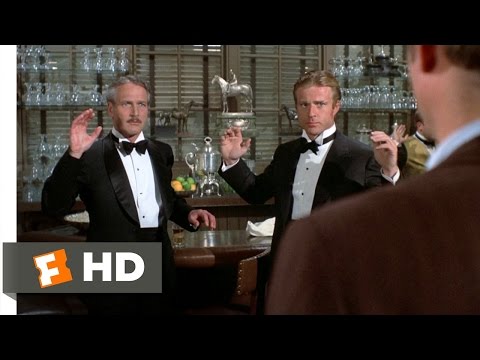
Find the location of `seatback`. seatback is located at coordinates (247, 274).